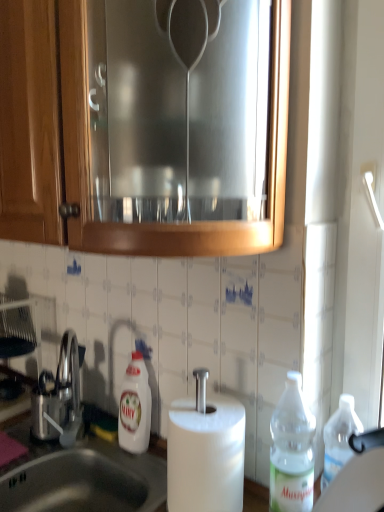
Question: Can you confirm if white glossy bottle at lower center, which is counted as the first bottle, starting from the back, is taller than satin silver sink at lower left?

Choices:
 (A) no
 (B) yes

Answer: (B)

Question: Can you confirm if white glossy bottle at lower center, the first bottle from the left, is positioned to the left of satin silver sink at lower left?

Choices:
 (A) yes
 (B) no

Answer: (B)

Question: Can you confirm if white glossy bottle at lower center, the first bottle from the left, is positioned to the right of satin silver sink at lower left?

Choices:
 (A) no
 (B) yes

Answer: (B)

Question: Is white glossy bottle at lower center, the 2th bottle when ordered from front to back, bigger than satin silver sink at lower left?

Choices:
 (A) no
 (B) yes

Answer: (A)

Question: Does white glossy bottle at lower center, the 2th bottle when ordered from front to back, have a lesser height compared to satin silver sink at lower left?

Choices:
 (A) yes
 (B) no

Answer: (B)

Question: Is brushed metal cabinet at upper center spatially inside satin nickel faucet at lower left, or outside of it?

Choices:
 (A) inside
 (B) outside

Answer: (B)

Question: Looking at their shapes, would you say brushed metal cabinet at upper center is wider or thinner than satin nickel faucet at lower left?

Choices:
 (A) thin
 (B) wide

Answer: (B)

Question: From a real-world perspective, is brushed metal cabinet at upper center above or below satin nickel faucet at lower left?

Choices:
 (A) above
 (B) below

Answer: (A)

Question: From the image's perspective, is brushed metal cabinet at upper center above or below satin nickel faucet at lower left?

Choices:
 (A) above
 (B) below

Answer: (A)

Question: Is clear plastic bottle at right, which appears as the 1th bottle when viewed from the right, inside or outside of brushed metal cabinet at upper center?

Choices:
 (A) inside
 (B) outside

Answer: (B)

Question: From a real-world perspective, is clear plastic bottle at right, which ranks as the 2th bottle in back-to-front order, above or below brushed metal cabinet at upper center?

Choices:
 (A) above
 (B) below

Answer: (B)

Question: From the image's perspective, is clear plastic bottle at right, the 2th bottle from the left, above or below brushed metal cabinet at upper center?

Choices:
 (A) below
 (B) above

Answer: (A)

Question: Is point (273, 421) positioned closer to the camera than point (233, 206)?

Choices:
 (A) farther
 (B) closer

Answer: (A)

Question: Considering the positions of satin silver sink at lower left and clear plastic bottle at right, which appears as the 1th bottle when viewed from the right, in the image, is satin silver sink at lower left taller or shorter than clear plastic bottle at right, which appears as the 1th bottle when viewed from the right,?

Choices:
 (A) short
 (B) tall

Answer: (A)

Question: Considering the relative positions of satin silver sink at lower left and clear plastic bottle at right, the 2th bottle from the left, in the image provided, is satin silver sink at lower left to the left or to the right of clear plastic bottle at right, the 2th bottle from the left,?

Choices:
 (A) left
 (B) right

Answer: (A)